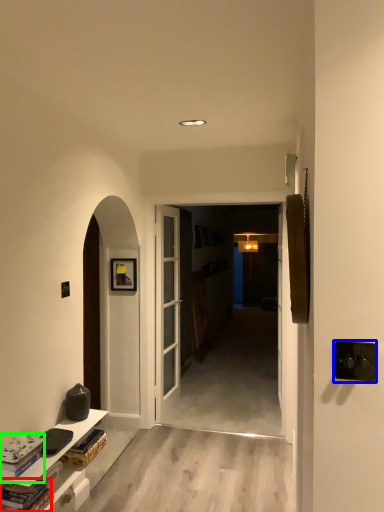
Question: Which object is positioned farthest from book (highlighted by a red box)? Select from door handle (highlighted by a blue box) and book (highlighted by a green box).

Choices:
 (A) door handle
 (B) book

Answer: (A)